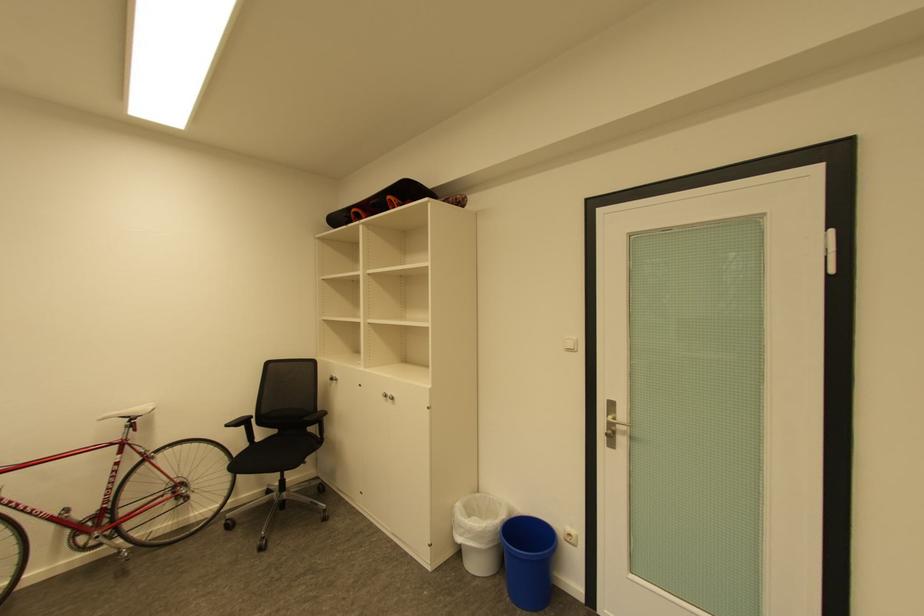
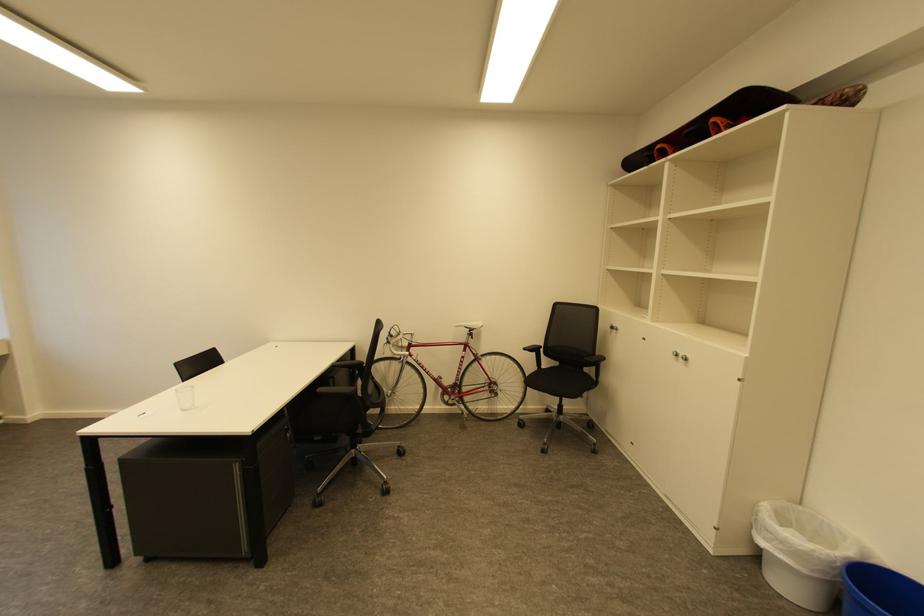
Locate, in the second image, the point that corresponds to (393,397) in the first image.

(684, 355)